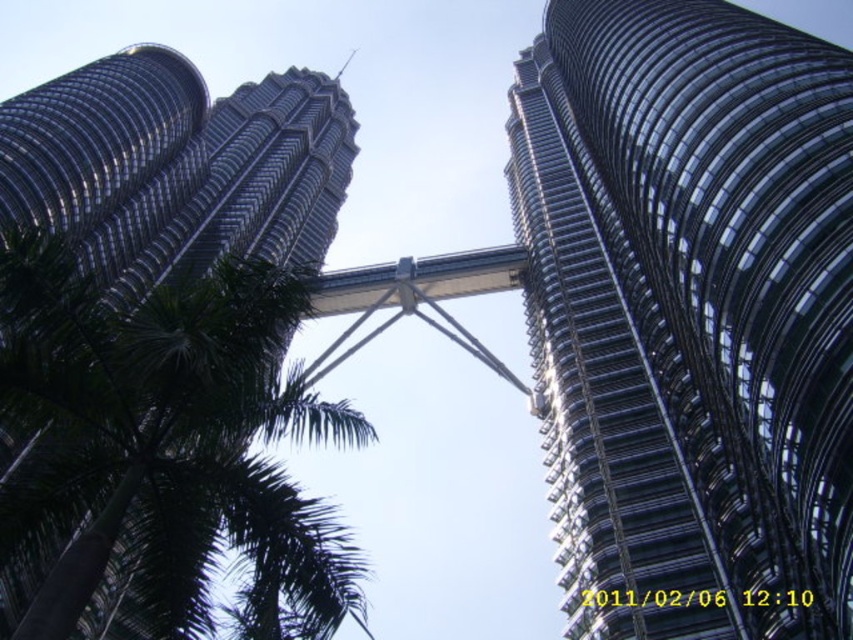
Question: Which point is closer to the camera?

Choices:
 (A) glassy steel tower at center
 (B) shiny metallic tower at upper left

Answer: (A)

Question: Observing the image, what is the correct spatial positioning of glassy steel tower at center in reference to shiny metallic tower at upper left?

Choices:
 (A) right
 (B) left

Answer: (A)

Question: Does glassy steel tower at center appear on the right side of shiny metallic tower at upper left?

Choices:
 (A) yes
 (B) no

Answer: (A)

Question: Does glassy steel tower at center appear on the left side of shiny metallic tower at upper left?

Choices:
 (A) yes
 (B) no

Answer: (B)